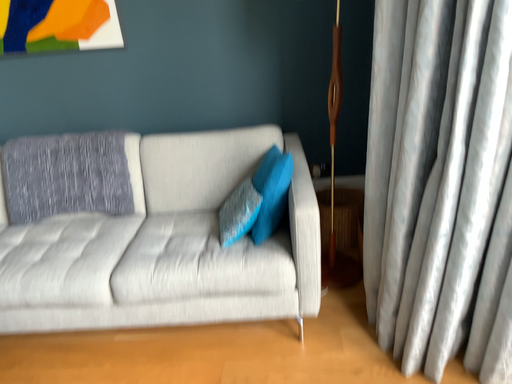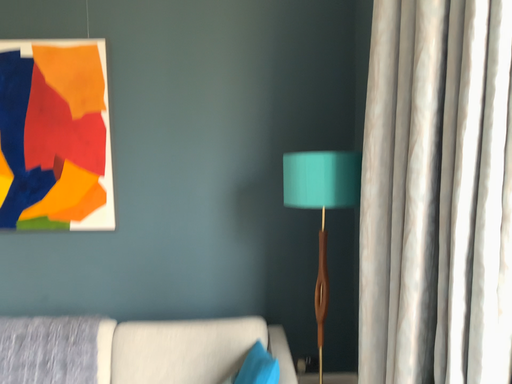
Question: How did the camera likely rotate when shooting the video?

Choices:
 (A) rotated downward
 (B) rotated upward

Answer: (B)